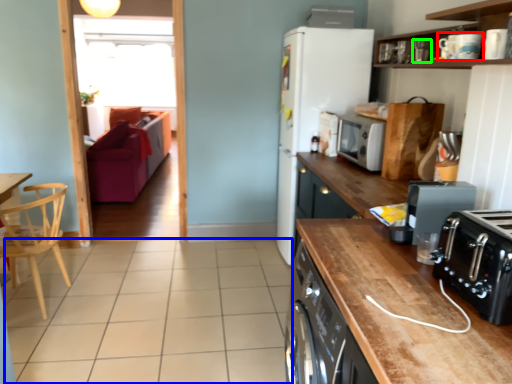
Question: Which is farther away from appliance (highlighted by a red box)? tile (highlighted by a blue box) or appliance (highlighted by a green box)?

Choices:
 (A) tile
 (B) appliance

Answer: (A)